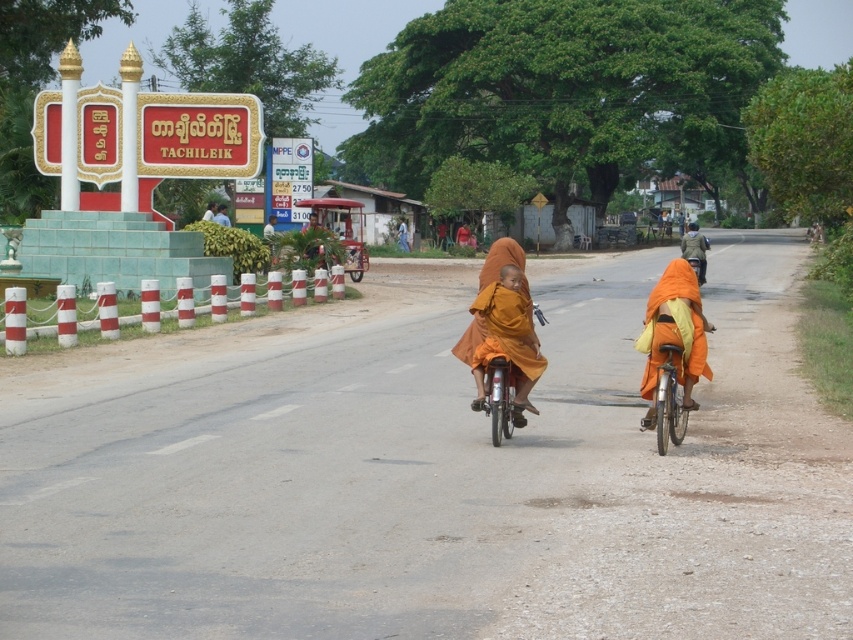
You are a traveler on the road and see the metallic orange bicycle at center and the camouflage fabric jacket at right. Which object is closer to the left side of the road?

The metallic orange bicycle at center is positioned on the left side of camouflage fabric jacket at right, so it is closer to the left side of the road.

You are a traveler who wants to reach TACHILEIK. You see a metallic orange bicycle at center. Based on the scene description, which direction should you head towards to reach TACHILEIK?

The signpost with the name TACHILEIK is on the left side of the road. Since the metallic orange bicycle at center is positioned at point [498,397], you should head towards the left side of the road to reach TACHILEIK.

You are a delivery person who needs to carry a large package that requires a wider space. You see a metallic orange bicycle at center and a camouflage fabric jacket at right. Which item would be more suitable for carrying the package?

The camouflage fabric jacket at right is wider than the metallic orange bicycle at center, so it would be more suitable for carrying the large package that requires a wider space.